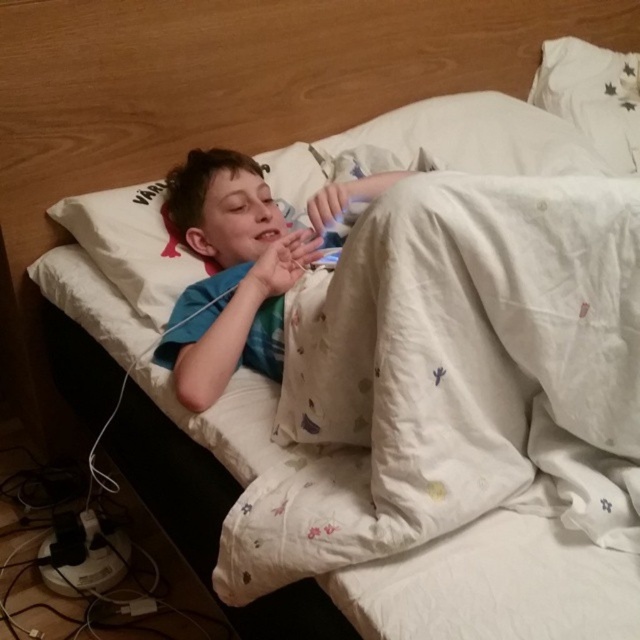
Question: Is white cotton pillow at upper left smaller than blue cotton shirt at center?

Choices:
 (A) no
 (B) yes

Answer: (A)

Question: Which object appears closest to the camera in this image?

Choices:
 (A) blue cotton shirt at center
 (B) white cotton pillow at upper right

Answer: (A)

Question: Which point appears closest to the camera in this image?

Choices:
 (A) (620, 163)
 (B) (216, 262)

Answer: (B)

Question: Is white cotton pillow at upper left smaller than white cotton pillow at upper right?

Choices:
 (A) no
 (B) yes

Answer: (A)

Question: Does blue cotton shirt at center appear over white cotton pillow at upper right?

Choices:
 (A) no
 (B) yes

Answer: (A)

Question: Which point is closer to the camera taking this photo?

Choices:
 (A) (250, 301)
 (B) (593, 125)

Answer: (A)